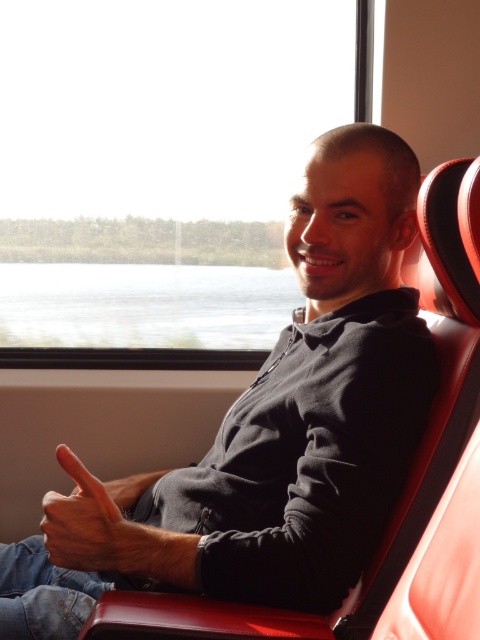
Question: Which point is closer to the camera taking this photo?

Choices:
 (A) (60, 516)
 (B) (91, 529)

Answer: (B)

Question: Does matte black hoodie at center lie in front of matte black hand at center?

Choices:
 (A) yes
 (B) no

Answer: (A)

Question: Can you confirm if matte black hoodie at center is bigger than matte black hand at center?

Choices:
 (A) no
 (B) yes

Answer: (B)

Question: Which of these objects is positioned closest to the matte black hoodie at center?

Choices:
 (A) matte black hand at center
 (B) transparent glass window at upper center

Answer: (A)

Question: Observing the image, what is the correct spatial positioning of matte black hoodie at center in reference to matte black hand at center?

Choices:
 (A) above
 (B) below

Answer: (A)

Question: Estimate the real-world distances between objects in this image. Which object is closer to the matte black hand at center?

Choices:
 (A) transparent glass window at upper center
 (B) matte black hoodie at center

Answer: (B)